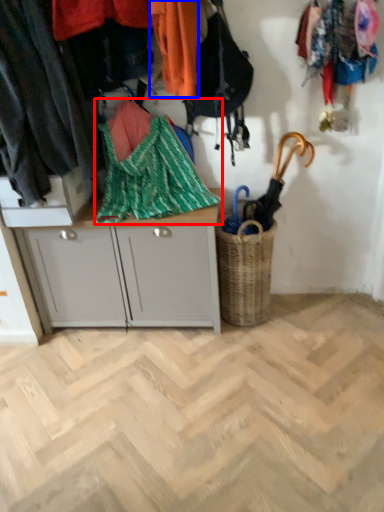
Question: Which of the following is the closest to the observer, blanket (highlighted by a red box) or clothing (highlighted by a blue box)?

Choices:
 (A) blanket
 (B) clothing

Answer: (B)